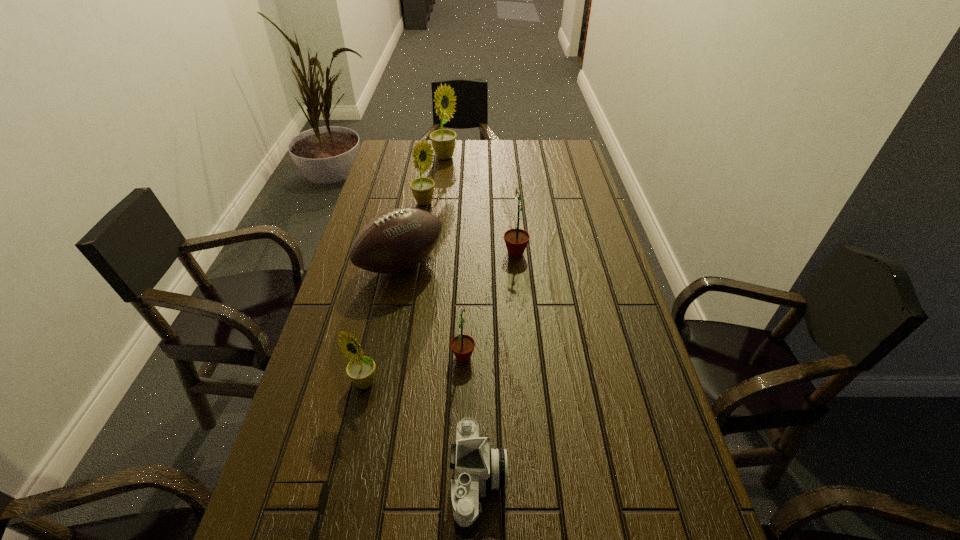
This screenshot has height=540, width=960. I want to click on the smallest yellow sunflower, so click(x=361, y=369).

Find the location of a particular element. The width and height of the screenshot is (960, 540). vacant space located 0.250m on the face of the biggest yellow sunflower is located at coordinates (519, 158).

Find the location of `vacant space situated 0.130m on the face of the second nearest yellow sunflower`. vacant space situated 0.130m on the face of the second nearest yellow sunflower is located at coordinates (473, 203).

This screenshot has height=540, width=960. Find the location of `blank space located on the face of the rightmost sunflower`. blank space located on the face of the rightmost sunflower is located at coordinates (470, 253).

You are a GUI agent. You are given a task and a screenshot of the screen. Output one action in this format:
    pyautogui.click(x=<x>, y=<y>)
    Task: Click on the free region located on the face of the rightmost sunflower
    
    Given the screenshot: What is the action you would take?
    pyautogui.click(x=390, y=253)

Locate an element on the screen. This screenshot has width=960, height=540. free space located on the face of the rightmost sunflower is located at coordinates tap(455, 253).

In order to click on vacant space situated 0.230m on the front of the football (American) in this screenshot , I will do `click(384, 355)`.

Identify the location of vacant region located on the face of the left green sunflower. point(589,357).

I want to click on free space located 0.220m on the face of the nearest yellow sunflower, so click(x=339, y=497).

In order to click on object that is at the far edge in this screenshot , I will do `click(443, 141)`.